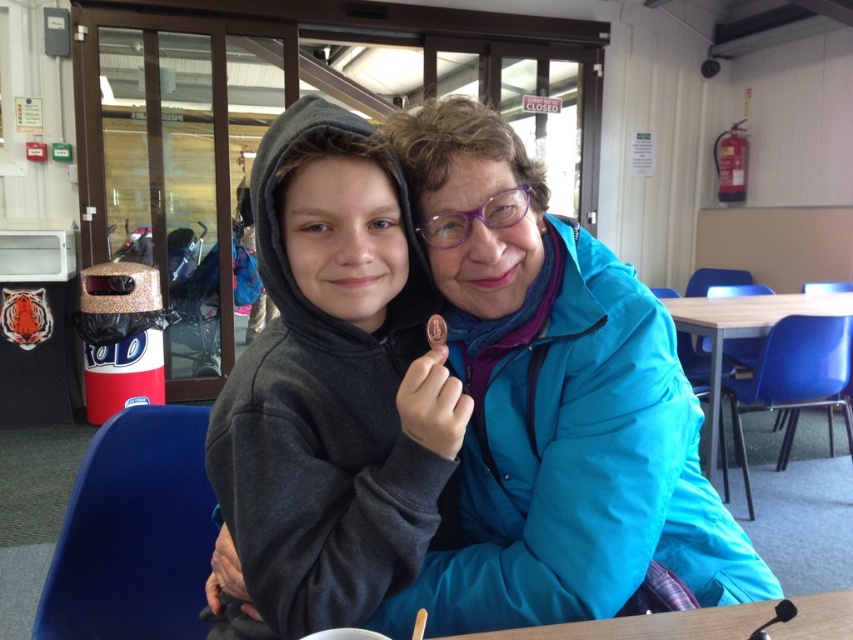
You are a photographer trying to capture a candid shot of the two people in the scene. The camera you are using has a depth of field that can only focus on objects within a 5 inch range. Given that the blue fuzzy jacket at center and matte gray hoodie at center are 4.97 inches apart, will both subjects be in focus when taking the photo?

The blue fuzzy jacket at center and matte gray hoodie at center are 4.97 inches apart, so both subjects will be in focus since the distance between them is within the 5 inch range of the camera.

You are a person who is 160 cm tall and want to sit comfortably at the wooden table at lower center and the wooden table at center. Which table would require you to stand on a stool to reach the height?

The wooden table at center has a greater height than the wooden table at lower center, so you would need to use a stool to reach the wooden table at center.